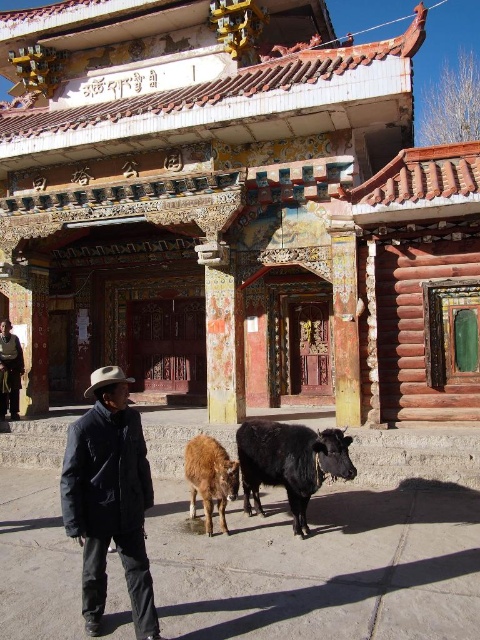
You are a photographer standing 1.5 meters away from the black glossy bull at lower center. You want to take a photo of the white felt cowboy hat at center without moving the bull. Can you move closer to the hat to get a better shot?

The black glossy bull at lower center is 2.73 meters away from the white felt cowboy hat at center. Since you are already 1.5 meters away from the bull, the total distance between you and the hat is 2.73 meters minus your current distance of 1.5 meters, which equals 1.23 meters. Therefore, you can move closer to the hat to get a better shot as there is space between you and the hat.

You are a photographer standing in front of the Tibetan building. You want to take a photo of the black glossy bull at lower center and the white felt cowboy hat at center. Which object is shorter in height?

The black glossy bull at lower center is not as tall as the white felt cowboy hat at center, so the black glossy bull at lower center is shorter in height.

You are a photographer setting up a tripod to capture the Tibetan building and its surroundings. You notice the black glossy bull at lower center and the white felt cowboy hat at center. Which object takes up more area in the photo?

The white felt cowboy hat at center occupies more space than the black glossy bull at lower center according to the description.